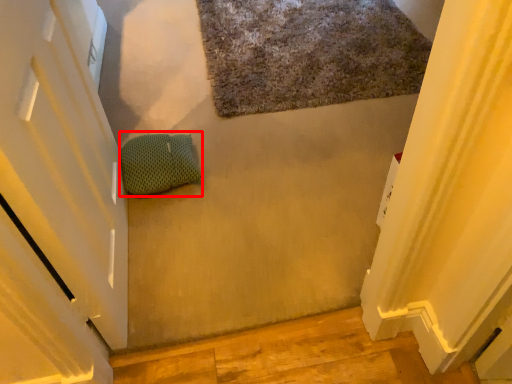
Question: From the image's perspective, what is the correct spatial relationship of pillow (annotated by the red box) in relation to bath mat?

Choices:
 (A) below
 (B) above

Answer: (A)